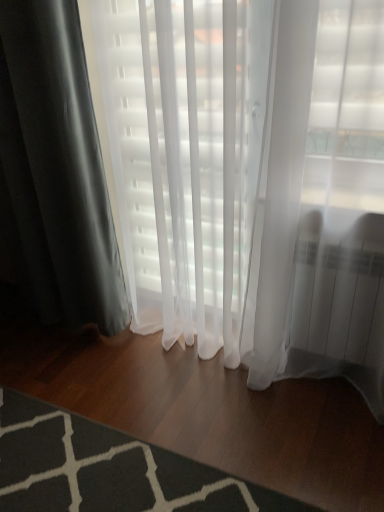
Find the location of `vacant area on the back side of dark gray textured rug at lower left`. vacant area on the back side of dark gray textured rug at lower left is located at coordinates (110, 374).